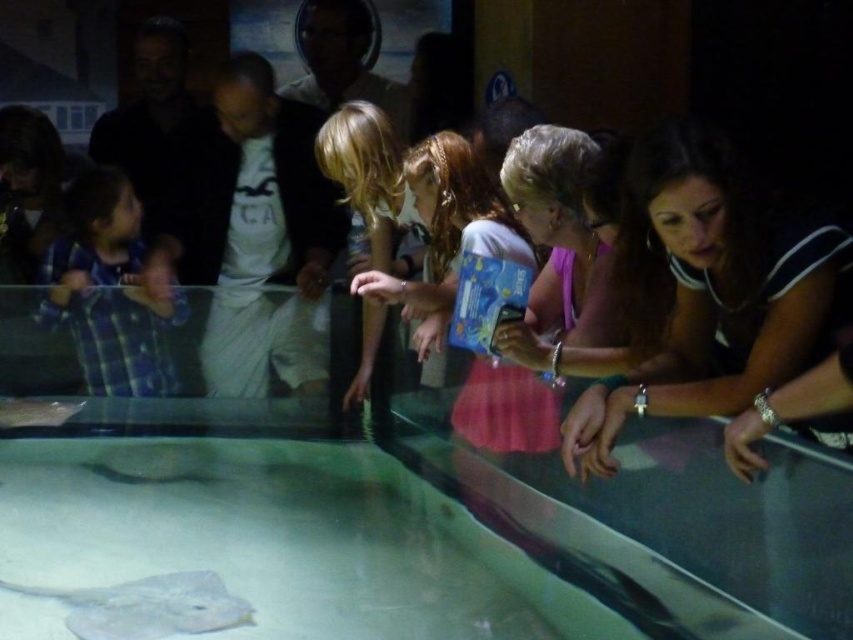
Who is shorter, pink satin dress at center or blonde hair at center?

pink satin dress at center is shorter.

Is pink satin dress at center bigger than blonde hair at center?

Incorrect, pink satin dress at center is not larger than blonde hair at center.

Find the location of a particular element. Image resolution: width=853 pixels, height=640 pixels. pink satin dress at center is located at coordinates (447, 230).

Based on the photo, between blonde hair at center and gray matte stingray at lower left, which one is positioned higher?

blonde hair at center is higher up.

You are a GUI agent. You are given a task and a screenshot of the screen. Output one action in this format:
    pyautogui.click(x=<x>, y=<y>)
    Task: Click on the blonde hair at center
    This screenshot has height=640, width=853.
    Given the screenshot: What is the action you would take?
    pyautogui.click(x=368, y=173)

Consider the image. Which of these two, blue plaid shirt at left or pink satin dress at center, stands shorter?

pink satin dress at center is shorter.

Image resolution: width=853 pixels, height=640 pixels. Describe the element at coordinates (111, 291) in the screenshot. I see `blue plaid shirt at left` at that location.

Where is `blue plaid shirt at left`? blue plaid shirt at left is located at coordinates (111, 291).